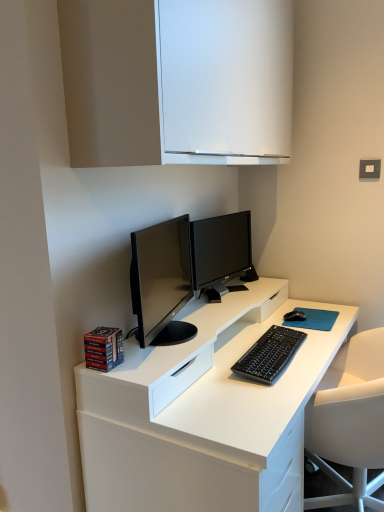
Locate an element on the screen. free location to the right of hardcover book at lower left is located at coordinates (156, 358).